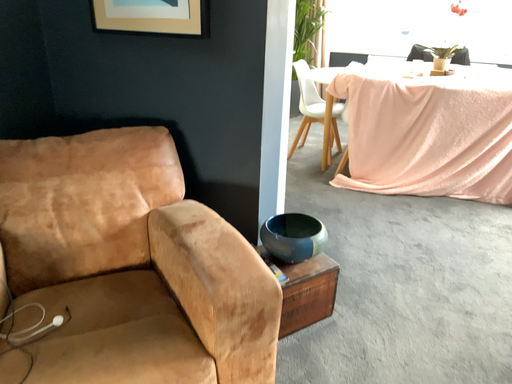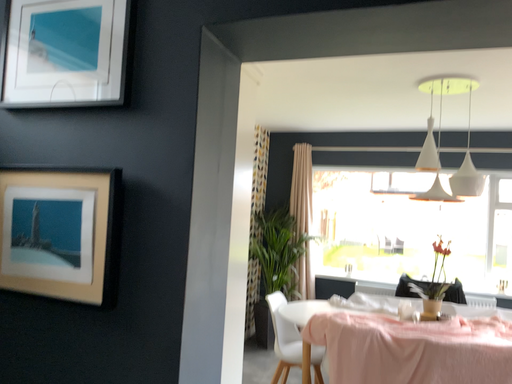
Question: How did the camera likely rotate when shooting the video?

Choices:
 (A) rotated upward
 (B) rotated downward

Answer: (A)